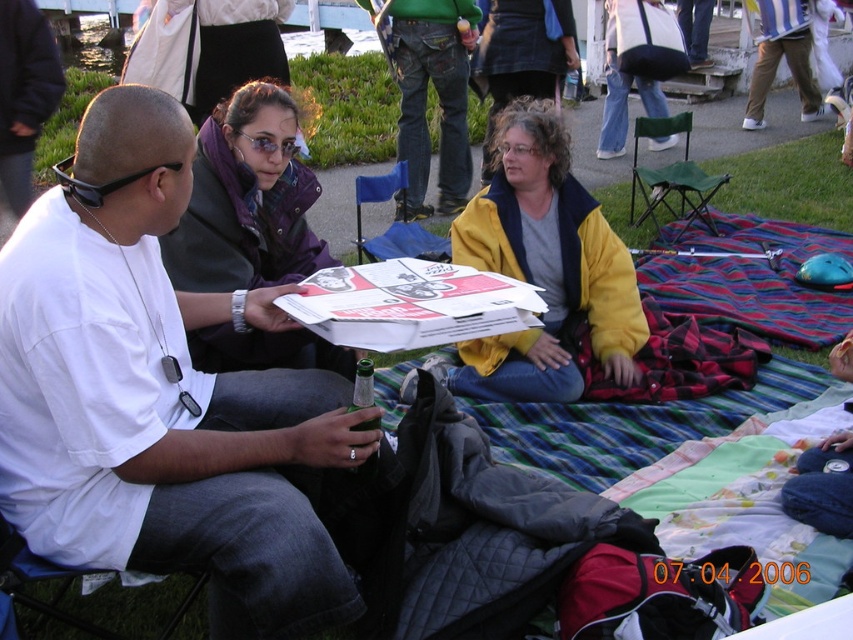
Between point (86, 492) and point (573, 248), which one is positioned in front?

Point (86, 492) is in front.

Can you confirm if white matte shirt at center is positioned to the left of yellow fleece jacket at center?

Correct, you'll find white matte shirt at center to the left of yellow fleece jacket at center.

I want to click on white matte shirt at center, so click(x=160, y=396).

You are a GUI agent. You are given a task and a screenshot of the screen. Output one action in this format:
    pyautogui.click(x=<x>, y=<y>)
    Task: Click on the white matte shirt at center
    The width and height of the screenshot is (853, 640).
    Given the screenshot: What is the action you would take?
    pyautogui.click(x=160, y=396)

Between point (137, 294) and point (279, 128), which one is positioned behind?

Positioned behind is point (279, 128).

What do you see at coordinates (160, 396) in the screenshot? I see `white matte shirt at center` at bounding box center [160, 396].

Identify the location of white matte shirt at center. This screenshot has width=853, height=640. (160, 396).

Can you confirm if yellow fleece jacket at center is bigger than matte purple jacket at center?

Yes, yellow fleece jacket at center is bigger than matte purple jacket at center.

Between point (625, 355) and point (265, 211), which one is positioned in front?

Point (265, 211) is more forward.

Identify the location of yellow fleece jacket at center. The width and height of the screenshot is (853, 640). (544, 266).